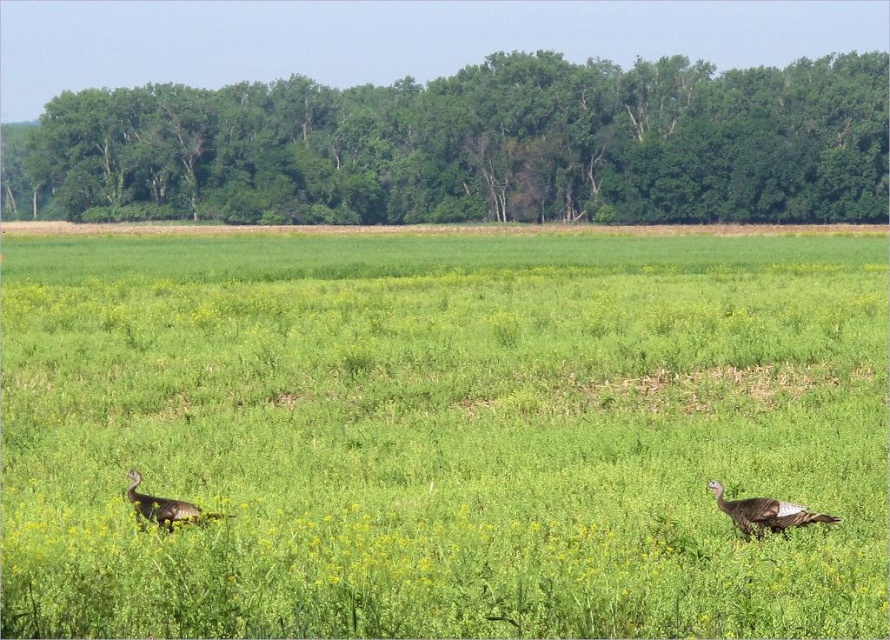
You are a drone operator trying to capture aerial footage of the green grassy field at center and the brown feathered turkey at lower left. Based on the scene description, which object occupies a wider area in the image?

The green grassy field at center occupies a wider area in the image because its width is larger than that of the brown feathered turkey at lower left.